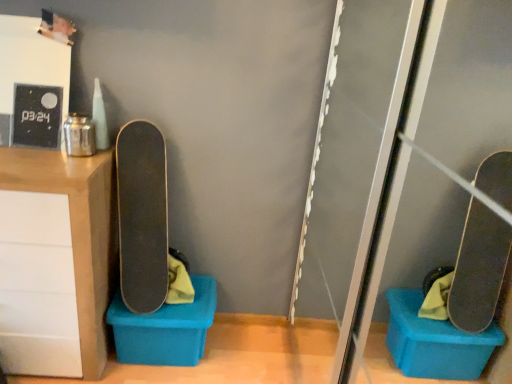
Find the location of `spots to the right of smooth black skateboard at center`. spots to the right of smooth black skateboard at center is located at coordinates (195, 300).